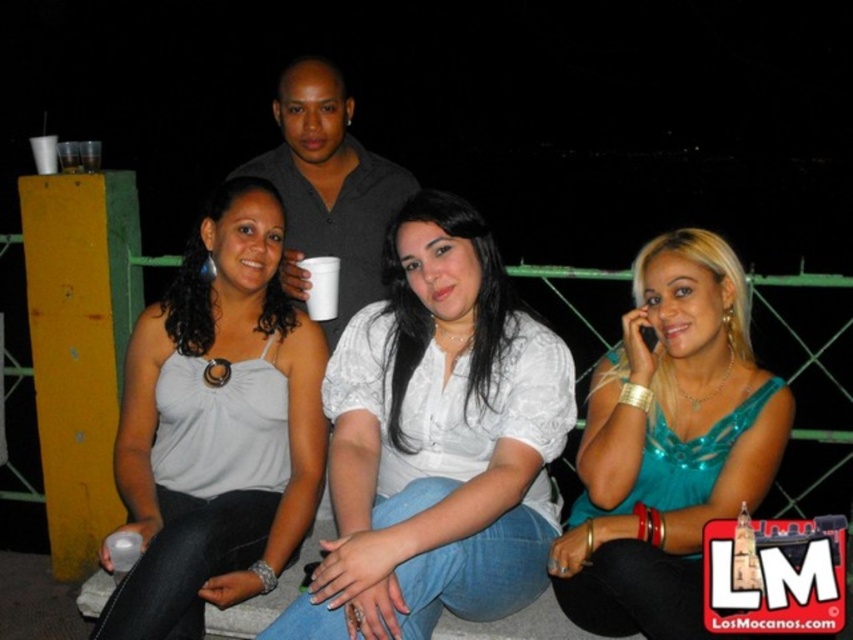
Which is below, white lace blouse at center or teal satin blouse at center?

teal satin blouse at center is lower down.

Is white lace blouse at center shorter than teal satin blouse at center?

Incorrect, white lace blouse at center's height does not fall short of teal satin blouse at center's.

What do you see at coordinates (437, 442) in the screenshot?
I see `white lace blouse at center` at bounding box center [437, 442].

This screenshot has width=853, height=640. Find the location of `white lace blouse at center`. white lace blouse at center is located at coordinates (437, 442).

In the scene shown: Who is taller, matte gray tank top at center or teal satin blouse at center?

With more height is matte gray tank top at center.

Locate an element on the screen. This screenshot has height=640, width=853. matte gray tank top at center is located at coordinates (218, 426).

This screenshot has width=853, height=640. Find the location of `matte gray tank top at center`. matte gray tank top at center is located at coordinates (218, 426).

Which is in front, point (341, 544) or point (173, 362)?

Point (341, 544)

Does white lace blouse at center have a greater height compared to matte gray tank top at center?

Incorrect, white lace blouse at center's height is not larger of matte gray tank top at center's.

Which is in front, point (480, 451) or point (189, 566)?

Point (189, 566) is more forward.

Locate an element on the screen. Image resolution: width=853 pixels, height=640 pixels. white lace blouse at center is located at coordinates (437, 442).